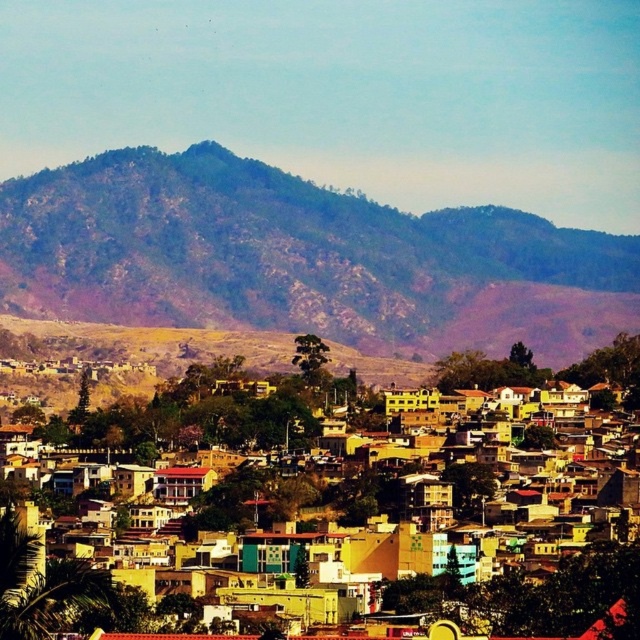
You are a drone operator who needs to fly a drone from the brown rocky mountain at upper center to the yellow matte buildings at center. What is the minimum distance you need to cover?

The minimum distance between the brown rocky mountain at upper center and the yellow matte buildings at center is 174.18 feet, so the drone needs to cover at least 174.18 feet.

Looking at this image, you are a city planner reviewing this urban layout. You need to determine the spatial relationship between the brown rocky mountain at upper center and the yellow matte buildings at center. Which object is located to the right of the other?

The brown rocky mountain at upper center is positioned on the right side of yellow matte buildings at center.

You are a drone operator who needs to fly a drone from the brown rocky mountain at upper center to the yellow matte buildings at center. According to the scene description, which direction should you fly the drone to reach the destination?

The brown rocky mountain at upper center is positioned over the yellow matte buildings at center, so you should fly the drone downward to reach the yellow matte buildings at center.